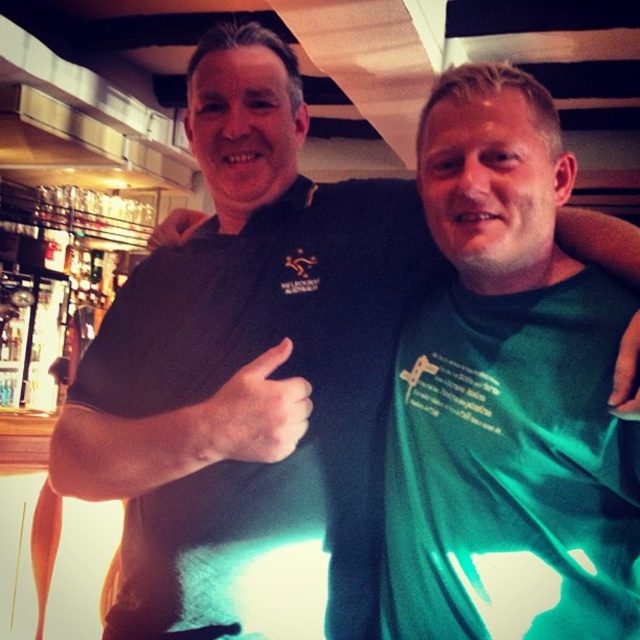
Question: Can you confirm if matte black thumb at center is bigger than matte black hand at upper center?

Choices:
 (A) no
 (B) yes

Answer: (A)

Question: Does green fabric hand at upper right lie behind matte black hand at upper center?

Choices:
 (A) no
 (B) yes

Answer: (A)

Question: Which of the following is the farthest from the observer?

Choices:
 (A) (182, 208)
 (B) (224, 442)
 (C) (609, 397)

Answer: (A)

Question: From the image, what is the correct spatial relationship of green fabric hand at upper right in relation to matte black hand at upper center?

Choices:
 (A) below
 (B) above

Answer: (A)

Question: Which object is closer to the camera taking this photo?

Choices:
 (A) green fabric hand at upper right
 (B) matte black hand at upper center

Answer: (A)

Question: Among these points, which one is nearest to the camera?

Choices:
 (A) (x=164, y=241)
 (B) (x=220, y=451)

Answer: (B)